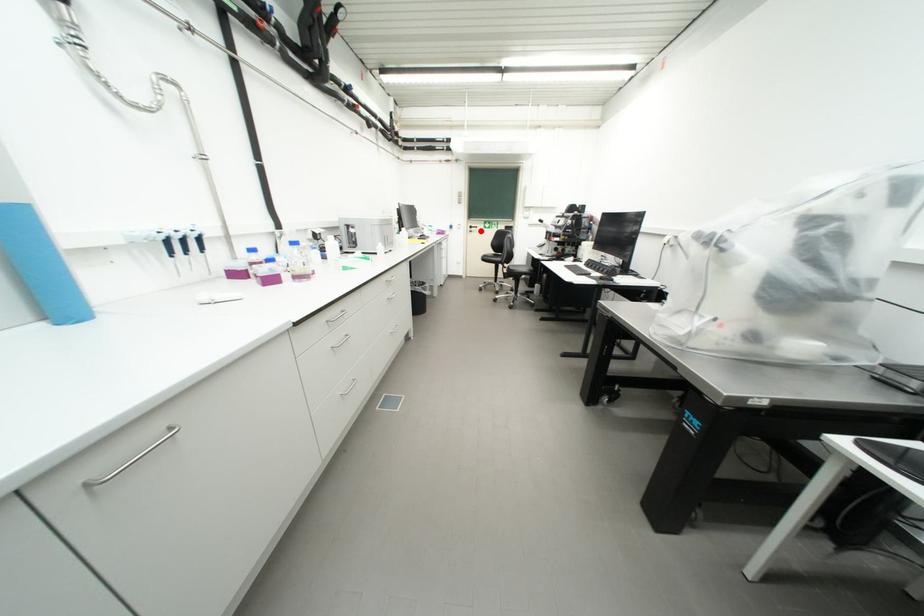
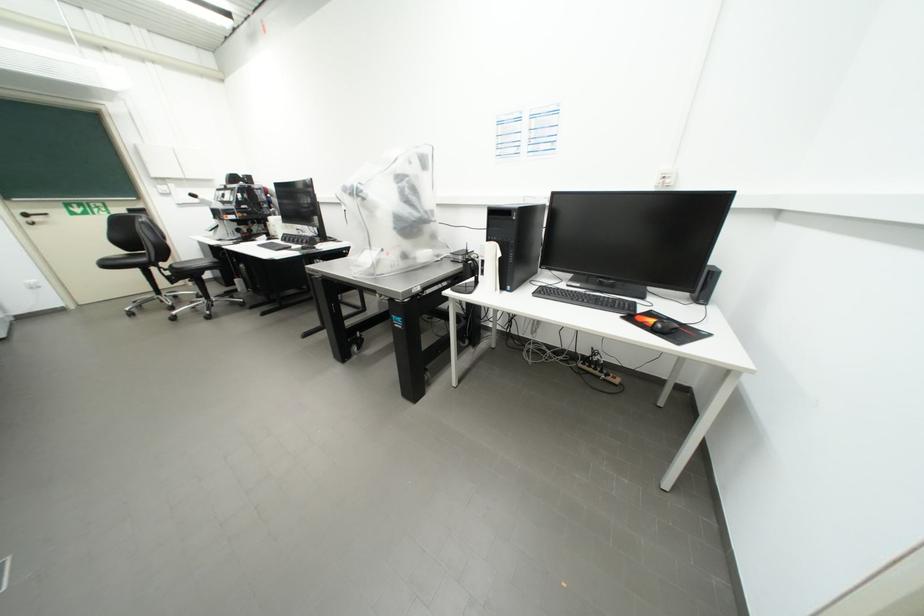
Question: I am providing you with two images of the same scene from different viewpoints. Image1 has a red point marked. In image2, the corresponding 3D location appears at what relative position? Reply with the corresponding letter.

Choices:
 (A) Closer
 (B) Farther

Answer: (B)